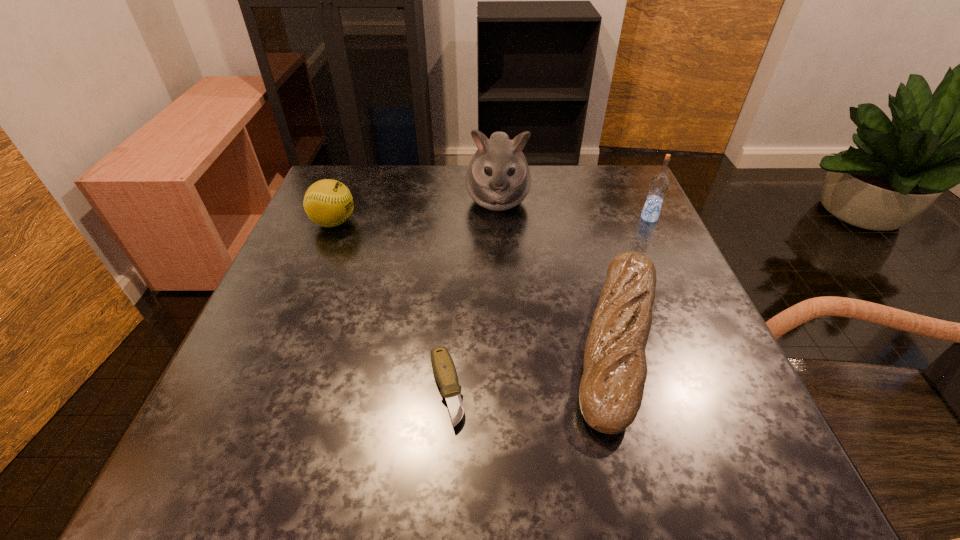
Where is `vacant space positioned 0.400m on the logo side of the leftmost object`? Image resolution: width=960 pixels, height=540 pixels. vacant space positioned 0.400m on the logo side of the leftmost object is located at coordinates [x=530, y=222].

You are a GUI agent. You are given a task and a screenshot of the screen. Output one action in this format:
    pyautogui.click(x=<x>, y=<y>)
    Task: Click on the vacant space situated 0.070m on the front of the second object from right to left
    The image size is (960, 540).
    Given the screenshot: What is the action you would take?
    pyautogui.click(x=660, y=492)

This screenshot has height=540, width=960. I want to click on vacant region located on the left of the shortest object, so click(x=231, y=389).

This screenshot has height=540, width=960. What are the coordinates of `hamster present at the far edge` in the screenshot? It's located at (498, 178).

The height and width of the screenshot is (540, 960). I want to click on vodka positioned at the far edge, so click(x=659, y=184).

This screenshot has height=540, width=960. I want to click on softball located in the far edge section of the desktop, so click(x=328, y=203).

Locate an element on the screen. baguet that is at the near edge is located at coordinates (611, 390).

What are the coordinates of `pocketknife that is at the near edge` in the screenshot? It's located at click(444, 370).

Identify the location of object that is at the left edge. This screenshot has width=960, height=540. (328, 203).

At what (x,y) coordinates should I click in order to perform the action: click on vodka present at the right edge. Please return your answer as a coordinate pair (x, y). The image size is (960, 540). Looking at the image, I should click on (659, 184).